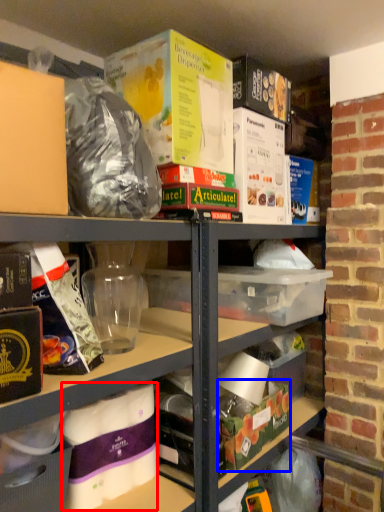
Question: Which object appears closest to the camera in this image, yoghurt (highlighted by a red box) or storage box (highlighted by a blue box)?

Choices:
 (A) yoghurt
 (B) storage box

Answer: (A)